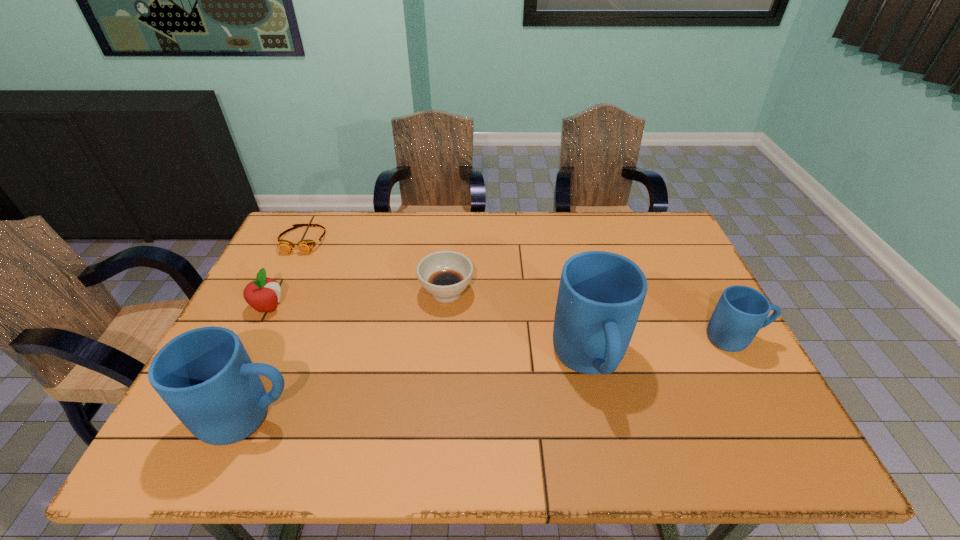
At what (x,y) coordinates should I click in order to perform the action: click on object that is at the near left corner. Please return your answer as a coordinate pair (x, y). Image resolution: width=960 pixels, height=540 pixels. Looking at the image, I should click on (205, 376).

Find the location of a particular element. Image resolution: width=960 pixels, height=540 pixels. vacant space at the far edge of the desktop is located at coordinates (591, 218).

The height and width of the screenshot is (540, 960). In the image, there is a desktop. Identify the location of vacant space at the near edge. (463, 398).

In the image, there is a desktop. At what (x,y) coordinates should I click in order to perform the action: click on free space at the left edge. Please return your answer as a coordinate pair (x, y). Looking at the image, I should click on point(286,274).

You are a GUI agent. You are given a task and a screenshot of the screen. Output one action in this format:
    pyautogui.click(x=<x>, y=<y>)
    Task: Click on the vacant area between the goggles and the apple
    The image size is (960, 540).
    Given the screenshot: What is the action you would take?
    pyautogui.click(x=286, y=274)

This screenshot has width=960, height=540. Identify the location of free space between the goggles and the fourth tallest object. (286, 274).

Locate an element on the screen. This screenshot has height=540, width=960. free spot between the third tallest object and the goggles is located at coordinates (519, 289).

At what (x,y) coordinates should I click in order to perform the action: click on free space between the fourth tallest object and the fifth tallest object. Please return your answer as a coordinate pair (x, y). The width and height of the screenshot is (960, 540). Looking at the image, I should click on (357, 300).

Locate an element on the screen. This screenshot has height=540, width=960. free space between the second mug from right to left and the fourth object from left to right is located at coordinates (518, 327).

The height and width of the screenshot is (540, 960). I want to click on free spot between the apple and the third object from right to left, so click(357, 300).